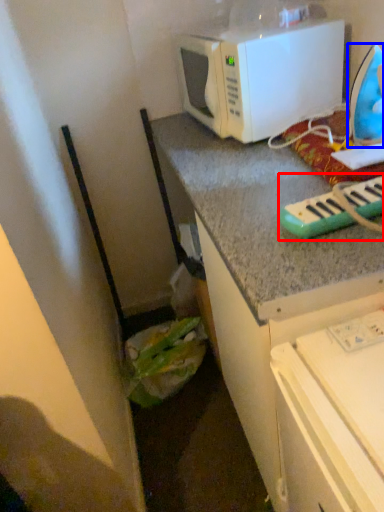
Question: Which object appears farthest to the camera in this image, musical keyboard (highlighted by a red box) or appliance (highlighted by a blue box)?

Choices:
 (A) musical keyboard
 (B) appliance

Answer: (B)